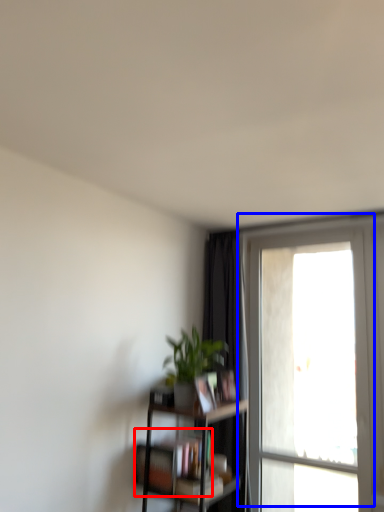
Question: Which of the following is the closest to the observer, book (highlighted by a red box) or window (highlighted by a blue box)?

Choices:
 (A) book
 (B) window

Answer: (A)